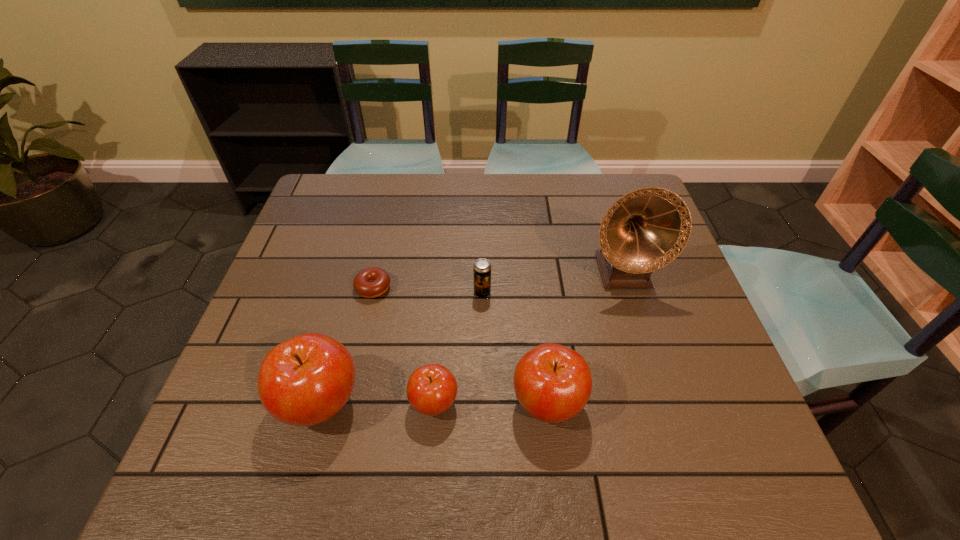
Find the location of `vacant space positioned on the back of the fourth object from right to left`. vacant space positioned on the back of the fourth object from right to left is located at coordinates (439, 350).

This screenshot has width=960, height=540. I want to click on free location located on the right of the rightmost apple, so click(648, 402).

Locate an element on the screen. The image size is (960, 540). free location located on the horn of the tallest object is located at coordinates (666, 414).

You are a GUI agent. You are given a task and a screenshot of the screen. Output one action in this format:
    pyautogui.click(x=<x>, y=<y>)
    Task: Click on the free space located 0.270m on the front of the shortest object
    Image resolution: width=960 pixels, height=540 pixels.
    Given the screenshot: What is the action you would take?
    pyautogui.click(x=348, y=402)

Locate an element on the screen. This screenshot has width=960, height=540. vacant region located on the back of the beer can is located at coordinates click(x=482, y=249).

Find the location of a particular element. object that is at the left edge is located at coordinates (304, 381).

Image resolution: width=960 pixels, height=540 pixels. Find the location of `object that is positioned at the right edge`. object that is positioned at the right edge is located at coordinates (646, 229).

Identify the location of object present at the near left corner. The height and width of the screenshot is (540, 960). (304, 381).

Where is `free space at the far edge`? Image resolution: width=960 pixels, height=540 pixels. free space at the far edge is located at coordinates (463, 184).

The width and height of the screenshot is (960, 540). Identify the location of blank space at the near edge of the desktop. (584, 420).